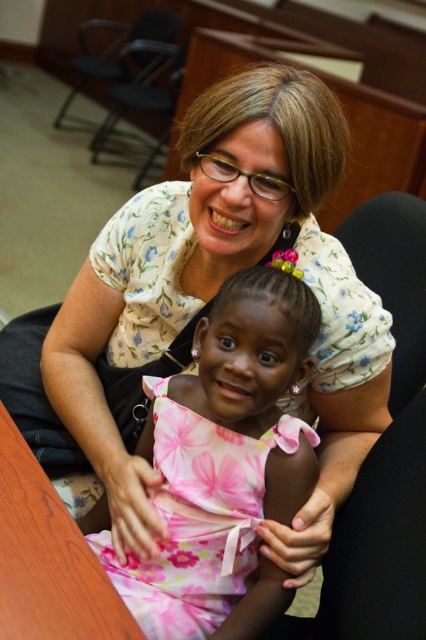
Which is below, pink floral fabric dress at center or wooden table at lower left?

pink floral fabric dress at center is below.

In order to click on pink floral fabric dress at center in this screenshot , I will do `click(198, 518)`.

Is point (284, 444) in front of point (80, 545)?

No, (284, 444) is further to viewer.

You are a GUI agent. You are given a task and a screenshot of the screen. Output one action in this format:
    pyautogui.click(x=<x>, y=<y>)
    Task: Click on the pink floral fabric dress at center
    
    Given the screenshot: What is the action you would take?
    pyautogui.click(x=198, y=518)